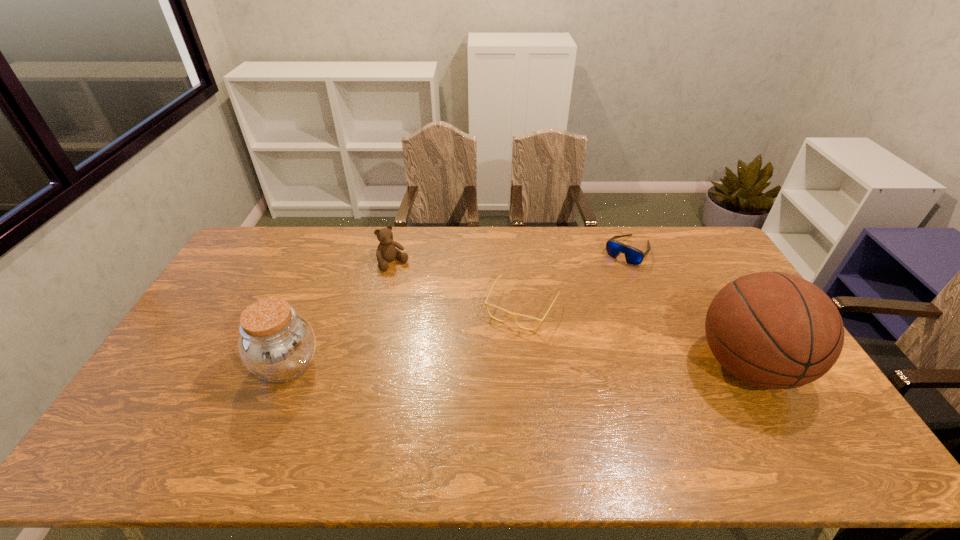
Find the location of a particular element. object positioned at the near edge is located at coordinates (774, 330).

Identify the location of object that is at the right edge. (774, 330).

Locate an element on the screen. object located in the near right corner section of the desktop is located at coordinates (774, 330).

I want to click on blank area at the far edge, so click(x=584, y=253).

This screenshot has height=540, width=960. In the image, there is a desktop. What are the coordinates of `vacant space at the near edge` in the screenshot? It's located at (616, 424).

In the image, there is a desktop. Where is `vacant space at the left edge`? vacant space at the left edge is located at coordinates (268, 272).

Find the location of a particular element. The image size is (960, 540). blank area at the far left corner is located at coordinates (276, 256).

In the image, there is a desktop. Find the location of `free space at the far right corner`. free space at the far right corner is located at coordinates (708, 243).

Where is `free spot between the sunglasses and the shortest object`? This screenshot has height=540, width=960. free spot between the sunglasses and the shortest object is located at coordinates (575, 279).

Locate an element on the screen. Image resolution: width=960 pixels, height=540 pixels. free spot between the basketball and the fourth tallest object is located at coordinates coord(688,308).